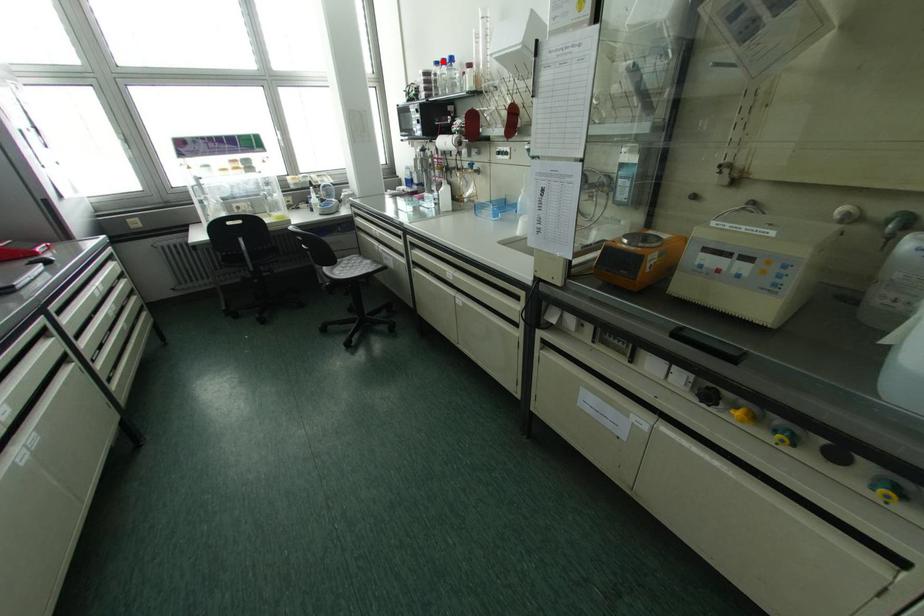
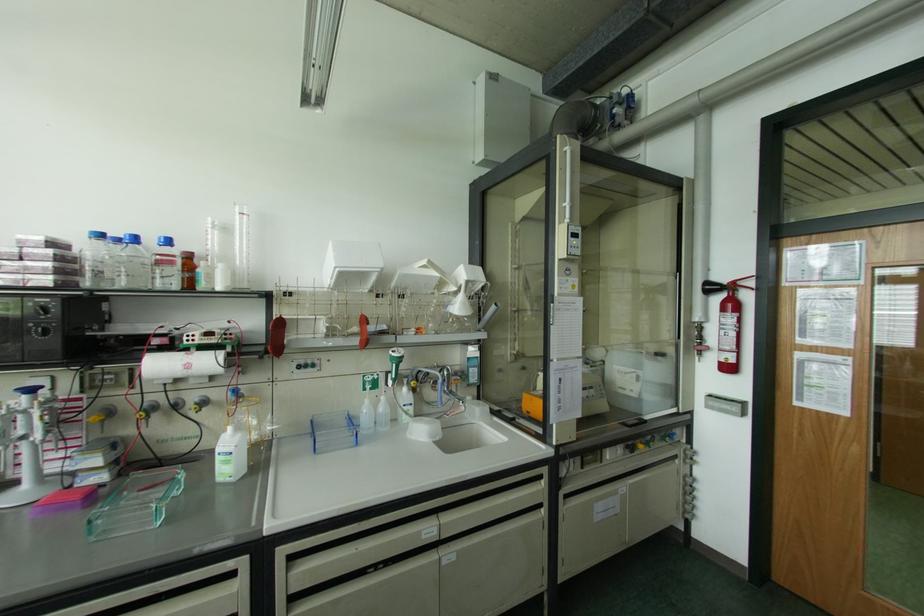
Locate, in the second image, the point that corresponds to the highlighted location in the first image.

(134, 238)